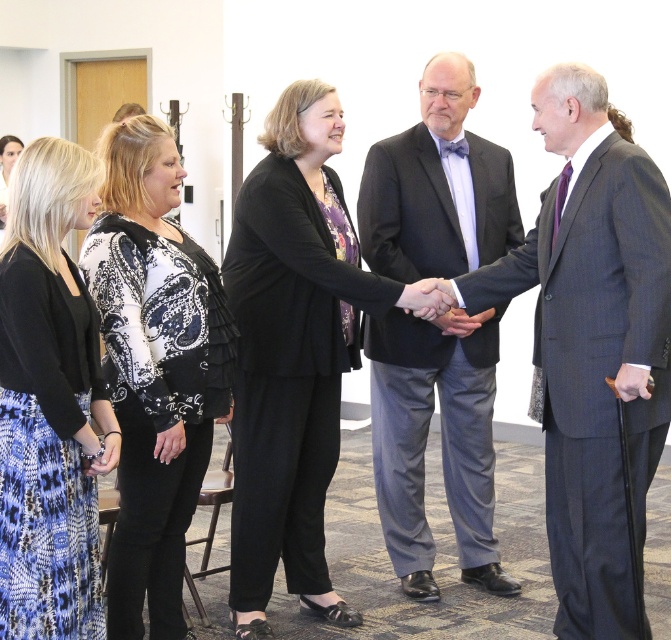
Between black fabric suit at center and printed fabric skirt at lower left, which one has less height?

printed fabric skirt at lower left

Is point (289, 566) closer to camera compared to point (79, 449)?

No, it is not.

Who is more forward, [303,144] or [17,268]?

Positioned in front is point [17,268].

I want to click on black fabric suit at center, so click(x=291, y=355).

Is point (597, 145) more distant than point (421, 305)?

No.

Which is in front, point (580, 291) or point (446, 296)?

Point (580, 291)

Is point (597, 561) farther from camera compared to point (427, 298)?

No, (597, 561) is in front of (427, 298).

Where is `dark gray pinstripe suit at right`? This screenshot has width=671, height=640. dark gray pinstripe suit at right is located at coordinates (595, 365).

Can you confirm if black fabric suit at center is positioned below black paisley blouse at center?

No.

Can you confirm if black fabric suit at center is wider than black paisley blouse at center?

Yes, black fabric suit at center is wider than black paisley blouse at center.

Describe the element at coordinates (291, 355) in the screenshot. I see `black fabric suit at center` at that location.

Locate an element on the screen. The image size is (671, 640). black fabric suit at center is located at coordinates (291, 355).